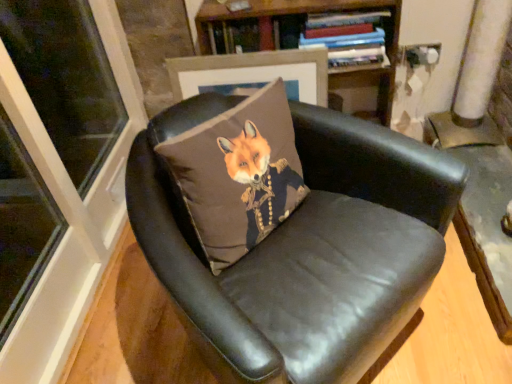
At what (x,y) coordinates should I click in order to perform the action: click on black leather chair at center. Please return your answer as a coordinate pair (x, y). The width and height of the screenshot is (512, 384). Looking at the image, I should click on (295, 235).

This screenshot has width=512, height=384. What are the coordinates of `wooden bookshelf at upper center` in the screenshot? It's located at (304, 34).

The image size is (512, 384). Describe the element at coordinates (238, 174) in the screenshot. I see `brown fabric fox at center` at that location.

In order to click on matte brown picture frame at upper center in this screenshot , I will do click(253, 74).

In the scene shown: Is black leather chair at center at the back of wooden bookshelf at upper center?

No.

From the image's perspective, is wooden bookshelf at upper center positioned above or below black leather chair at center?

Based on their image positions, wooden bookshelf at upper center is located above black leather chair at center.

Is wooden bookshelf at upper center touching black leather chair at center?

No.

From a real-world perspective, is wooden bookshelf at upper center above or below black leather chair at center?

In terms of real-world spatial position, wooden bookshelf at upper center is above black leather chair at center.

Considering the relative positions of black leather chair at center and matte brown picture frame at upper center in the image provided, is black leather chair at center behind matte brown picture frame at upper center?

That is False.

From the image's perspective, is black leather chair at center above or below matte brown picture frame at upper center?

black leather chair at center is below matte brown picture frame at upper center.

Which point is more forward, (302,380) or (268,57)?

Point (302,380)

Based on the photo, considering the relative sizes of black leather chair at center and matte brown picture frame at upper center in the image provided, is black leather chair at center taller than matte brown picture frame at upper center?

Indeed, black leather chair at center has a greater height compared to matte brown picture frame at upper center.

Locate an element on the screen. The image size is (512, 384). bookcase beneath the hardcover book at upper center (from a real-world perspective) is located at coordinates (304, 34).

From the picture: In the image, is wooden bookshelf at upper center positioned in front of or behind hardcover book at upper center?

wooden bookshelf at upper center is positioned farther from the viewer than hardcover book at upper center.

Considering the relative positions of wooden bookshelf at upper center and hardcover book at upper center in the image provided, is wooden bookshelf at upper center to the left or to the right of hardcover book at upper center?

From the image, it's evident that wooden bookshelf at upper center is to the left of hardcover book at upper center.

Is wooden bookshelf at upper center far away from hardcover book at upper center?

wooden bookshelf at upper center is actually quite close to hardcover book at upper center.

Is matte brown picture frame at upper center with hardcover book at upper center?

No, matte brown picture frame at upper center is not next to hardcover book at upper center.

Based on the photo, would you say matte brown picture frame at upper center is to the left or to the right of hardcover book at upper center in the picture?

In the image, matte brown picture frame at upper center appears on the left side of hardcover book at upper center.

Does matte brown picture frame at upper center turn towards hardcover book at upper center?

No, matte brown picture frame at upper center does not turn towards hardcover book at upper center.

From the image's perspective, is matte brown picture frame at upper center positioned above or below hardcover book at upper center?

matte brown picture frame at upper center is below hardcover book at upper center.

Looking at this image, from the image's perspective, which one is positioned lower, black leather chair at center or wooden bookshelf at upper center?

black leather chair at center.

Would you say black leather chair at center is inside or outside wooden bookshelf at upper center?

black leather chair at center is spatially situated outside wooden bookshelf at upper center.

Does point (230, 285) lie behind point (345, 80)?

No.

How different are the orientations of black leather chair at center and wooden bookshelf at upper center in degrees?

The angle between the facing direction of black leather chair at center and the facing direction of wooden bookshelf at upper center is 47.7 degrees.

Image resolution: width=512 pixels, height=384 pixels. I want to click on throw pillow on the left side of black leather chair at center, so pyautogui.click(x=238, y=174).

How many degrees apart are the facing directions of black leather chair at center and brown fabric fox at center?

They differ by 0.00262 degrees in their facing directions.

Can you confirm if black leather chair at center is taller than brown fabric fox at center?

Correct, black leather chair at center is much taller as brown fabric fox at center.

Based on the photo, is black leather chair at center positioned before brown fabric fox at center?

That is True.

In the scene shown: Would you say hardcover book at upper center is outside wooden bookshelf at upper center?

No, hardcover book at upper center is not entirely external to wooden bookshelf at upper center.

Is hardcover book at upper center placed right next to wooden bookshelf at upper center?

hardcover book at upper center and wooden bookshelf at upper center are clearly separated.

From a real-world perspective, between hardcover book at upper center and wooden bookshelf at upper center, who is vertically lower?

wooden bookshelf at upper center, from a real-world perspective.

Where is `chair on the left of the wooden bookshelf at upper center`? chair on the left of the wooden bookshelf at upper center is located at coordinates (295, 235).

Where is `chair below the matte brown picture frame at upper center (from a real-world perspective)`? The height and width of the screenshot is (384, 512). chair below the matte brown picture frame at upper center (from a real-world perspective) is located at coordinates (295, 235).

Based on their spatial positions, is wooden bookshelf at upper center or matte brown picture frame at upper center further from hardcover book at upper center?

matte brown picture frame at upper center lies further to hardcover book at upper center than the other object.

Based on their spatial positions, is hardcover book at upper center or wooden bookshelf at upper center further from matte brown picture frame at upper center?

hardcover book at upper center is further to matte brown picture frame at upper center.

Looking at the image, which one is located further to hardcover book at upper center, black leather chair at center or brown fabric fox at center?

black leather chair at center lies further to hardcover book at upper center than the other object.

From the image, which object appears to be farther from matte brown picture frame at upper center, wooden bookshelf at upper center or hardcover book at upper center?

hardcover book at upper center lies further to matte brown picture frame at upper center than the other object.

Looking at the image, which one is located further to brown fabric fox at center, hardcover book at upper center or wooden bookshelf at upper center?

wooden bookshelf at upper center.

From the image, which object appears to be farther from wooden bookshelf at upper center, hardcover book at upper center or matte brown picture frame at upper center?

Based on the image, matte brown picture frame at upper center appears to be further to wooden bookshelf at upper center.

Looking at the image, which one is located further to black leather chair at center, hardcover book at upper center or wooden bookshelf at upper center?

wooden bookshelf at upper center is further to black leather chair at center.

Looking at the image, which one is located further to black leather chair at center, wooden bookshelf at upper center or matte brown picture frame at upper center?

Based on the image, wooden bookshelf at upper center appears to be further to black leather chair at center.

You are a GUI agent. You are given a task and a screenshot of the screen. Output one action in this format:
    pyautogui.click(x=<x>, y=<y>)
    Task: Click on the book between black leather chair at center and matte brown picture frame at upper center in the front-back direction
    The image size is (512, 384).
    Given the screenshot: What is the action you would take?
    pyautogui.click(x=348, y=38)

At what (x,y) coordinates should I click in order to perform the action: click on throw pillow between black leather chair at center and wooden bookshelf at upper center from front to back. Please return your answer as a coordinate pair (x, y). Image resolution: width=512 pixels, height=384 pixels. Looking at the image, I should click on (238, 174).

This screenshot has height=384, width=512. I want to click on throw pillow between black leather chair at center and hardcover book at upper center along the z-axis, so click(238, 174).

You are a GUI agent. You are given a task and a screenshot of the screen. Output one action in this format:
    pyautogui.click(x=<x>, y=<y>)
    Task: Click on the bookcase positioned between brown fabric fox at center and matte brown picture frame at upper center from near to far
    The height and width of the screenshot is (384, 512).
    Given the screenshot: What is the action you would take?
    pyautogui.click(x=304, y=34)